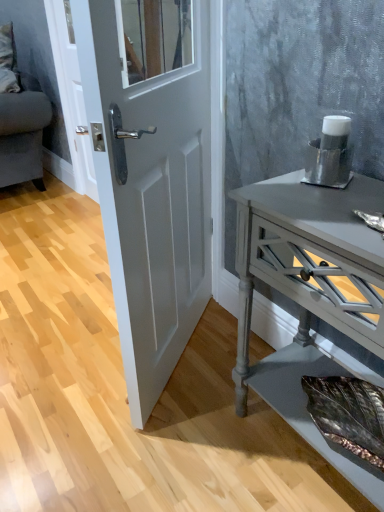
The image size is (384, 512). In order to click on free spot to the left of silver metallic cup at right in this screenshot , I will do `click(277, 188)`.